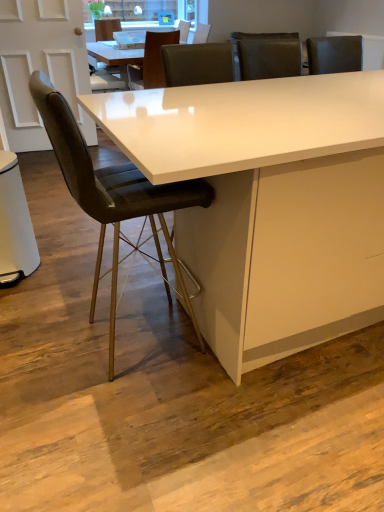
Question: Does matte black chair at upper center, positioned as the 1th chair in back-to-front order, appear on the left side of white glossy table at center?

Choices:
 (A) yes
 (B) no

Answer: (A)

Question: Considering the relative positions of matte black chair at upper center, positioned as the third chair in front-to-back order, and white glossy table at center in the image provided, is matte black chair at upper center, positioned as the third chair in front-to-back order, to the right of white glossy table at center from the viewer's perspective?

Choices:
 (A) yes
 (B) no

Answer: (B)

Question: From the image's perspective, would you say matte black chair at upper center, positioned as the 1th chair in back-to-front order, is shown under white glossy table at center?

Choices:
 (A) yes
 (B) no

Answer: (B)

Question: Can you see matte black chair at upper center, positioned as the third chair in front-to-back order, touching white glossy table at center?

Choices:
 (A) yes
 (B) no

Answer: (B)

Question: Could white glossy table at center be considered to be inside matte black chair at upper center, the third chair in the bottom-to-top sequence?

Choices:
 (A) yes
 (B) no

Answer: (B)

Question: Is matte black chair at upper center, which ranks as the 1th chair in top-to-bottom order, positioned in front of white glossy table at center?

Choices:
 (A) no
 (B) yes

Answer: (A)

Question: Is white glossy table at center in contact with leather at center, positioned as the 2th chair in top-to-bottom order?

Choices:
 (A) no
 (B) yes

Answer: (A)

Question: Is white glossy table at center facing away from leather at center, positioned as the 2th chair in top-to-bottom order?

Choices:
 (A) no
 (B) yes

Answer: (B)

Question: Does white glossy table at center have a smaller size compared to leather at center, the 2th chair from the front?

Choices:
 (A) yes
 (B) no

Answer: (B)

Question: Is white glossy table at center positioned far away from leather at center, positioned as the 2th chair in top-to-bottom order?

Choices:
 (A) yes
 (B) no

Answer: (A)

Question: Is white glossy table at center aimed at leather at center, the 2th chair from the front?

Choices:
 (A) no
 (B) yes

Answer: (A)

Question: Considering the relative sizes of white glossy table at center and leather at center, the 2th chair from the front, in the image provided, is white glossy table at center shorter than leather at center, the 2th chair from the front,?

Choices:
 (A) no
 (B) yes

Answer: (A)

Question: Does leather-like black chair at left, arranged as the third chair when viewed from the back, have a smaller size compared to white glossy table at center?

Choices:
 (A) yes
 (B) no

Answer: (A)